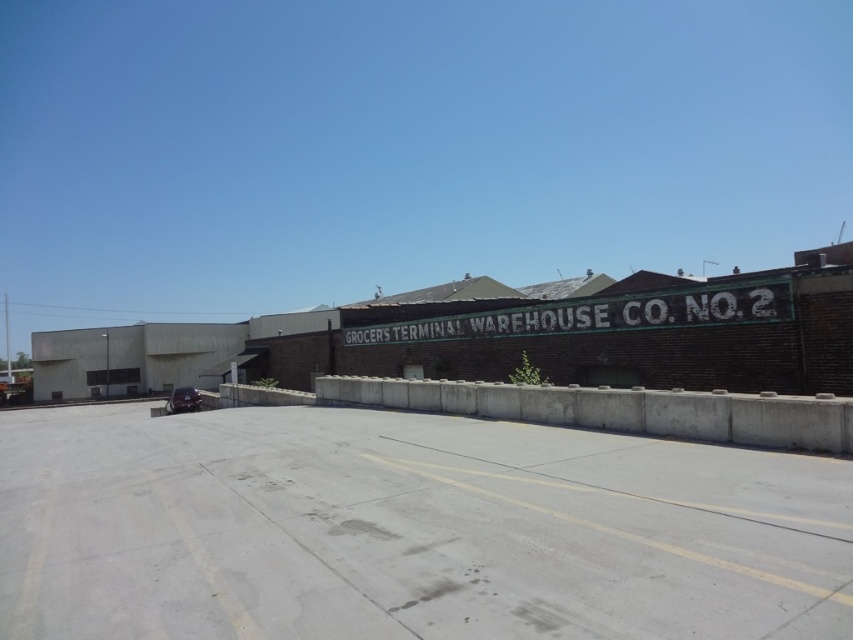
Is white painted metal sign at center positioned in front of shiny black car at lower left?

That is True.

Based on the photo, between white painted metal sign at center and shiny black car at lower left, which one appears on the right side from the viewer's perspective?

white painted metal sign at center

Identify the location of white painted metal sign at center. (595, 314).